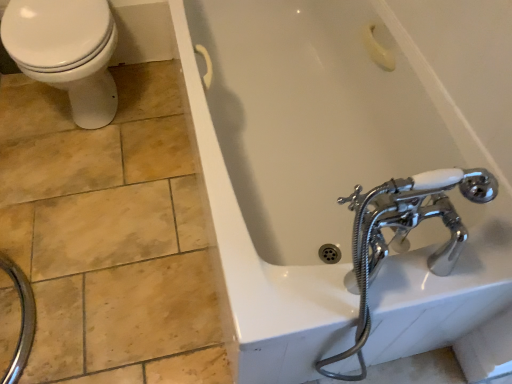
At what (x,y) coordinates should I click in order to perform the action: click on white glossy toilet at upper left. Please return your answer as a coordinate pair (x, y). The width and height of the screenshot is (512, 384). Looking at the image, I should click on (66, 52).

Describe the element at coordinates (66, 52) in the screenshot. I see `white glossy toilet at upper left` at that location.

The height and width of the screenshot is (384, 512). In order to click on white glossy bathtub at upper center in this screenshot , I will do `click(346, 167)`.

Image resolution: width=512 pixels, height=384 pixels. What do you see at coordinates (346, 167) in the screenshot?
I see `white glossy bathtub at upper center` at bounding box center [346, 167].

Measure the distance between point (455,131) and camera.

The distance of point (455,131) from camera is 1.08 meters.

What are the coordinates of `white glossy toilet at upper left` in the screenshot? It's located at (66, 52).

Between white glossy toilet at upper left and white glossy bathtub at upper center, which one appears on the left side from the viewer's perspective?

white glossy toilet at upper left.

Is white glossy toilet at upper left further to the viewer compared to white glossy bathtub at upper center?

Yes, it is.

Is point (37, 49) closer to viewer compared to point (293, 360)?

No, it is not.

From the image's perspective, which one is positioned lower, white glossy toilet at upper left or white glossy bathtub at upper center?

From the image's view, white glossy bathtub at upper center is below.

From a real-world perspective, is white glossy toilet at upper left physically below white glossy bathtub at upper center?

No, from a real-world perspective, white glossy toilet at upper left is not below white glossy bathtub at upper center.

From the picture: Considering the sizes of objects white glossy toilet at upper left and white glossy bathtub at upper center in the image provided, who is thinner, white glossy toilet at upper left or white glossy bathtub at upper center?

Thinner between the two is white glossy bathtub at upper center.

Does white glossy toilet at upper left have a lesser height compared to white glossy bathtub at upper center?

No, white glossy toilet at upper left is not shorter than white glossy bathtub at upper center.

Is white glossy toilet at upper left bigger or smaller than white glossy bathtub at upper center?

Clearly, white glossy toilet at upper left is smaller in size than white glossy bathtub at upper center.

Is white glossy toilet at upper left positioned beyond the bounds of white glossy bathtub at upper center?

white glossy toilet at upper left is positioned outside white glossy bathtub at upper center.

Is white glossy toilet at upper left in contact with white glossy bathtub at upper center?

No, white glossy toilet at upper left is not with white glossy bathtub at upper center.

Is white glossy toilet at upper left oriented towards white glossy bathtub at upper center?

No, white glossy toilet at upper left is not oriented towards white glossy bathtub at upper center.

Can you tell me how much white glossy toilet at upper left and white glossy bathtub at upper center differ in facing direction?

The facing directions of white glossy toilet at upper left and white glossy bathtub at upper center are 88.9 degrees apart.

Where is `bathtub on the right of white glossy toilet at upper left`? The width and height of the screenshot is (512, 384). bathtub on the right of white glossy toilet at upper left is located at coordinates (346, 167).

Is white glossy bathtub at upper center at the right side of white glossy toilet at upper left?

Indeed, white glossy bathtub at upper center is positioned on the right side of white glossy toilet at upper left.

In the image, is white glossy bathtub at upper center positioned in front of or behind white glossy toilet at upper left?

Clearly, white glossy bathtub at upper center is in front of white glossy toilet at upper left.

Is point (301, 256) positioned after point (73, 41)?

No, it is not.

From the image's perspective, is white glossy bathtub at upper center over white glossy toilet at upper left?

No, from the image's perspective, white glossy bathtub at upper center is not on top of white glossy toilet at upper left.

From a real-world perspective, between white glossy bathtub at upper center and white glossy toilet at upper left, who is vertically higher?

From a 3D spatial view, white glossy toilet at upper left is above.

Is white glossy bathtub at upper center wider or thinner than white glossy toilet at upper left?

In the image, white glossy bathtub at upper center appears to be more narrow than white glossy toilet at upper left.

Is white glossy bathtub at upper center shorter than white glossy toilet at upper left?

Yes, white glossy bathtub at upper center is shorter than white glossy toilet at upper left.

Looking at this image, considering the sizes of objects white glossy bathtub at upper center and white glossy toilet at upper left in the image provided, who is bigger, white glossy bathtub at upper center or white glossy toilet at upper left?

With larger size is white glossy bathtub at upper center.

Is white glossy bathtub at upper center positioned beyond the bounds of white glossy toilet at upper left?

white glossy bathtub at upper center is positioned outside white glossy toilet at upper left.

Are white glossy bathtub at upper center and white glossy toilet at upper left located far from each other?

No, white glossy bathtub at upper center is not far away from white glossy toilet at upper left.

Is white glossy bathtub at upper center positioned with its back to white glossy toilet at upper left?

No, white glossy bathtub at upper center is not facing away from white glossy toilet at upper left.

Measure the distance between white glossy bathtub at upper center and white glossy toilet at upper left.

The distance of white glossy bathtub at upper center from white glossy toilet at upper left is 28.86 inches.

The width and height of the screenshot is (512, 384). I want to click on bidet above the white glossy bathtub at upper center (from a real-world perspective), so coord(66,52).

Where is `bathtub lying below the white glossy toilet at upper left (from the image's perspective)`? bathtub lying below the white glossy toilet at upper left (from the image's perspective) is located at coordinates (346, 167).

Locate an element on the screen. bidet lying above the white glossy bathtub at upper center (from the image's perspective) is located at coordinates (66, 52).